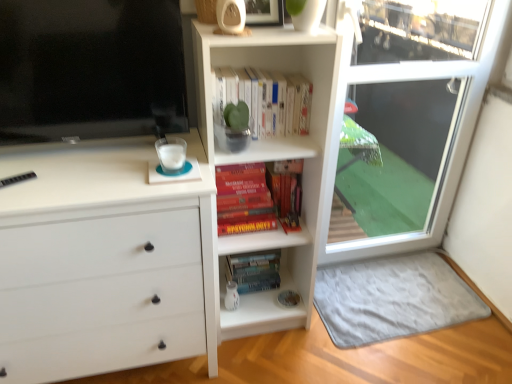
This screenshot has width=512, height=384. I want to click on vacant space underneath gray soft rug at lower right (from a real-world perspective), so click(x=393, y=296).